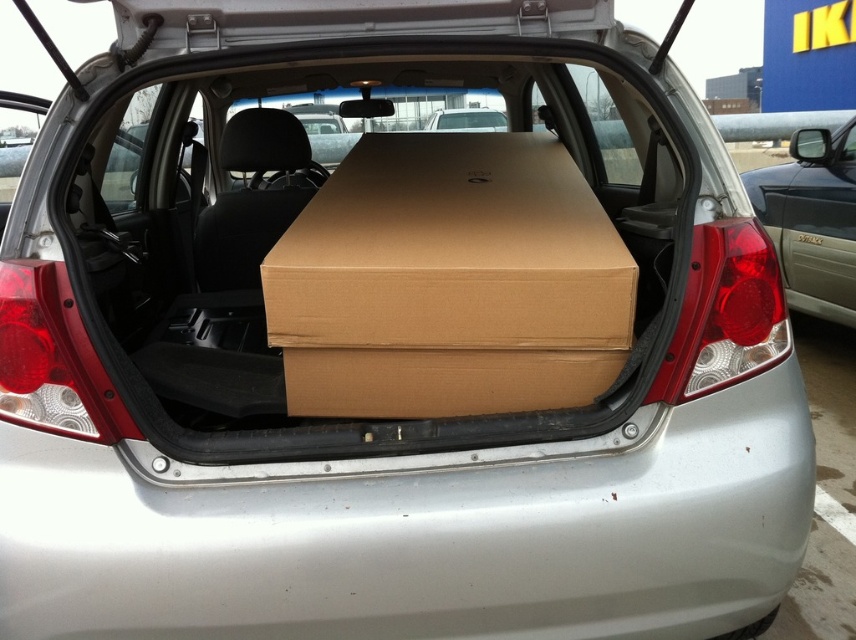
You are trying to load a new item into the trunk of the silver car. You see the brown cardboard box at center and the matte brown minivan at right. Which object is closer to the trunk opening?

Answer: The brown cardboard box at center is closer to the trunk opening because it is in front of the matte brown minivan at right.

You are trying to load a new item into the car trunk. The trunk has the brown cardboard box at center and the matte brown minivan at right. Which object is closer to the ground?

The brown cardboard box at center is closer to the ground because it is below the matte brown minivan at right.

You are trying to load a new box into the trunk of the silver car. The new box is the same size as the matte brown minivan at right. Can the brown cardboard box at center currently in the trunk fit inside the new box?

The brown cardboard box at center is shorter than the matte brown minivan at right. Since the new box is the same size as the matte brown minivan at right, the brown cardboard box at center can fit inside the new box because it is smaller in height.